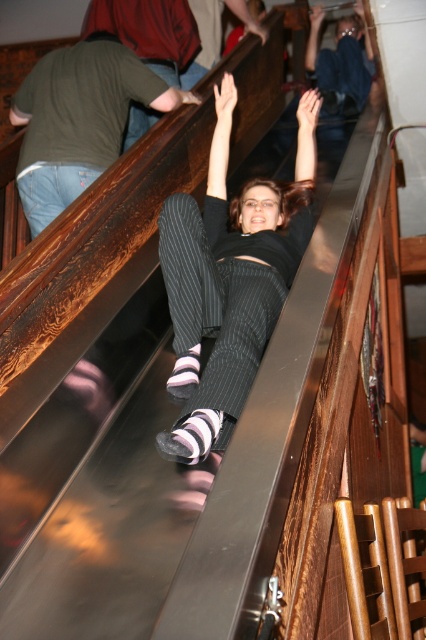
Question: Considering the relative positions of black pinstripe pants at center and jeans at left in the image provided, where is black pinstripe pants at center located with respect to jeans at left?

Choices:
 (A) right
 (B) left

Answer: (A)

Question: Among these points, which one is farthest from the camera?

Choices:
 (A) 54,58
 (B) 201,308

Answer: (A)

Question: Which object is closer to the camera taking this photo?

Choices:
 (A) jeans at left
 (B) black pinstripe pants at center

Answer: (B)

Question: Where is black pinstripe pants at center located in relation to jeans at left in the image?

Choices:
 (A) left
 (B) right

Answer: (B)

Question: Is black pinstripe pants at center bigger than jeans at left?

Choices:
 (A) no
 (B) yes

Answer: (B)